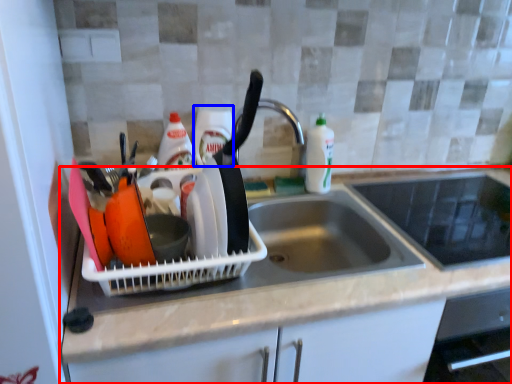
Question: Which point is further to the camera, countertop (highlighted by a red box) or bottle (highlighted by a blue box)?

Choices:
 (A) countertop
 (B) bottle

Answer: (B)